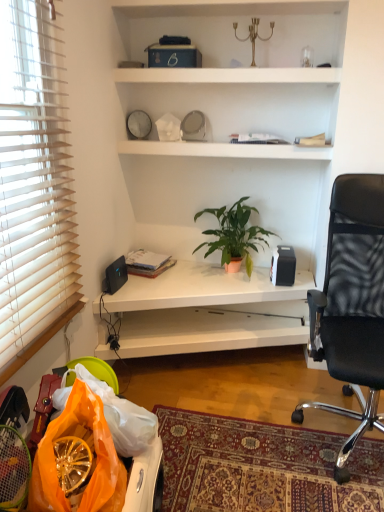
Identify the location of vacant space that's between black plastic speaker at lower left, which is the second loudspeaker from right to left, and black matte speaker at upper right, acting as the first loudspeaker starting from the right. (194, 281).